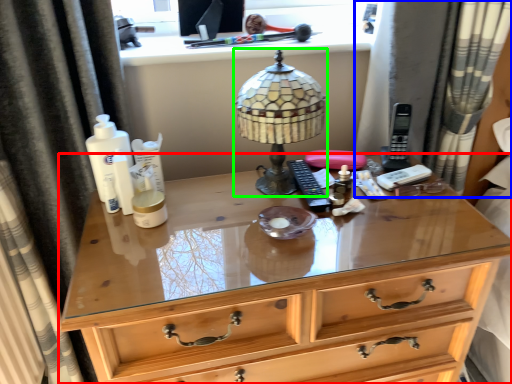
Question: Which object is the farthest from chest of drawers (highlighted by a red box)? Choose among these: curtain (highlighted by a blue box) or lamp (highlighted by a green box).

Choices:
 (A) curtain
 (B) lamp

Answer: (A)